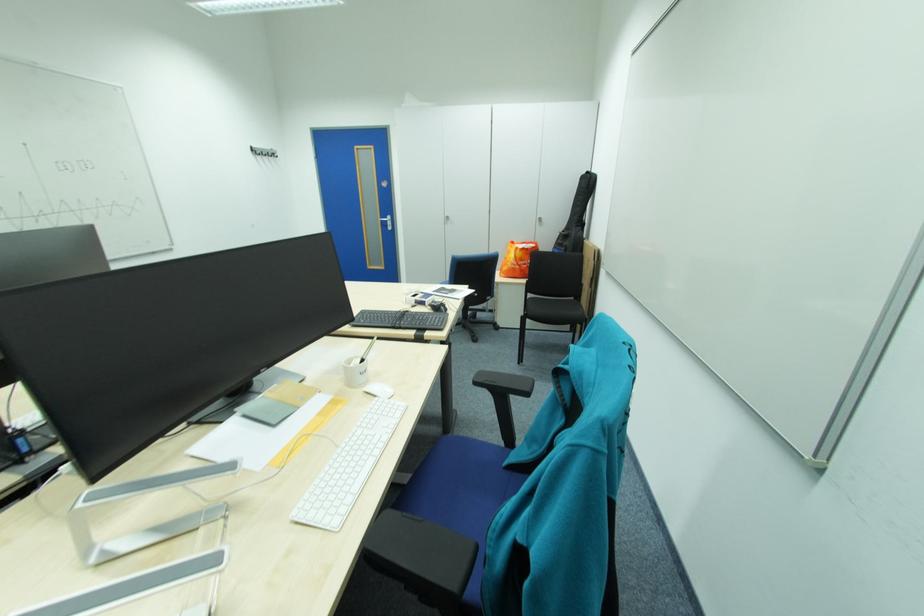
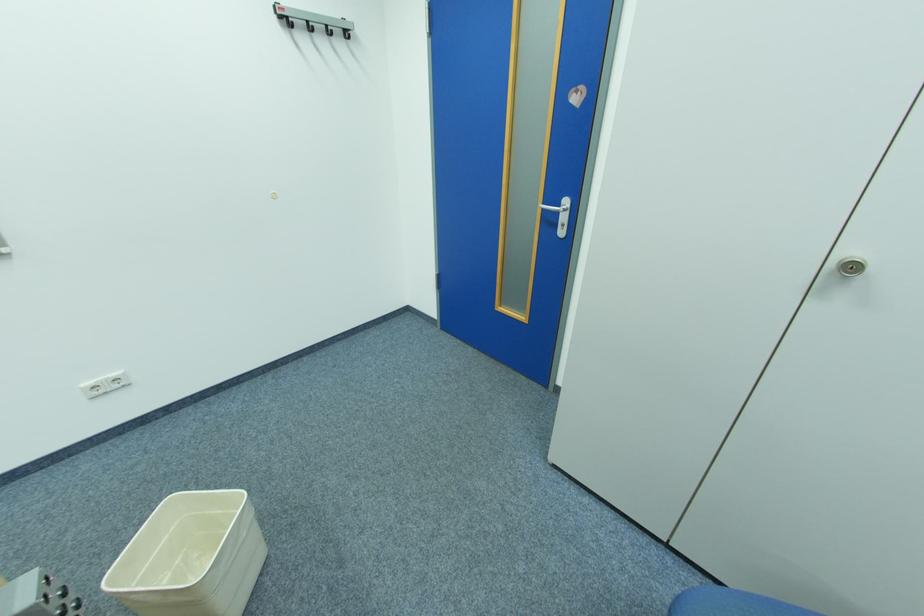
Where in the second image is the point corresponding to point (262, 153) from the first image?

(290, 25)